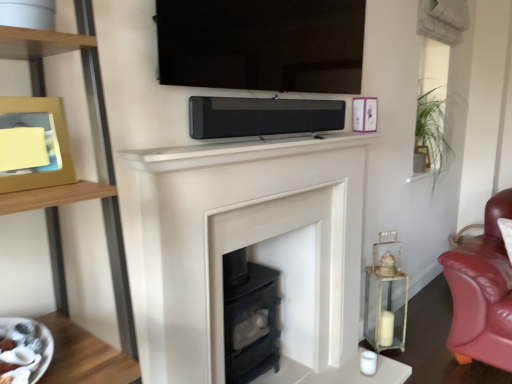
Locate an element on the screen. wooden picture frame at left, which is counted as the 1th picture frame, starting from the bottom is located at coordinates (33, 144).

This screenshot has height=384, width=512. In order to click on metallic purple picture frame at upper right, arranged as the second picture frame when viewed from the front in this screenshot , I will do `click(365, 114)`.

What is the approximate width of clear glass lantern at right?

It is 7.62 inches.

In order to click on black matte soundbar at center in this screenshot , I will do `click(261, 116)`.

Could you tell me if white glossy plate at lower left is facing metallic purple picture frame at upper right, the 2th picture frame from the left?

No, white glossy plate at lower left is not turned towards metallic purple picture frame at upper right, the 2th picture frame from the left.

Based on the photo, is white glossy plate at lower left not within metallic purple picture frame at upper right, which is counted as the 1th picture frame, starting from the back?

That's correct, white glossy plate at lower left is outside of metallic purple picture frame at upper right, which is counted as the 1th picture frame, starting from the back.

Consider the image. Which point is more distant from viewer, [114,380] or [366,125]?

Positioned behind is point [366,125].

Between white glossy plate at lower left and metallic purple picture frame at upper right, which is counted as the 1th picture frame, starting from the back, which one has smaller width?

metallic purple picture frame at upper right, which is counted as the 1th picture frame, starting from the back.

Which object is thinner, black matte soundbar at center or wooden picture frame at left, the 2th picture frame positioned from the right?

Thinner between the two is black matte soundbar at center.

Is black matte soundbar at center positioned before wooden picture frame at left, which appears as the second picture frame when viewed from the back?

No.

From the image's perspective, relative to green leafy plant at upper right, is white matte fireplace at center above or below?

Based on their image positions, white matte fireplace at center is located beneath green leafy plant at upper right.

Does white matte fireplace at center have a lesser width compared to green leafy plant at upper right?

Yes.

Is point (130, 261) positioned in front of point (437, 104)?

Yes.

Consider the image. How far apart are green leafy plant at upper right and clear glass lantern at right?

green leafy plant at upper right and clear glass lantern at right are 3.58 feet apart from each other.

Does point (438, 145) come farther from viewer compared to point (401, 346)?

Yes, point (438, 145) is behind point (401, 346).

Would you say green leafy plant at upper right contains clear glass lantern at right?

Actually, clear glass lantern at right is outside green leafy plant at upper right.

Is green leafy plant at upper right in contact with clear glass lantern at right?

No, green leafy plant at upper right is not with clear glass lantern at right.

From a real-world perspective, which is physically below, wooden picture frame at left, which appears as the 2th picture frame when viewed from the top, or white glossy plate at lower left?

white glossy plate at lower left, from a real-world perspective.

Can white glossy plate at lower left be found inside wooden picture frame at left, the 1th picture frame from the front?

No.

Does point (65, 136) appear closer or farther from the camera than point (55, 329)?

Point (65, 136) appears to be farther away from the viewer than point (55, 329).

From the image's perspective, between wooden picture frame at left, the 2th picture frame positioned from the right, and white glossy plate at lower left, which one is located above?

wooden picture frame at left, the 2th picture frame positioned from the right, from the image's perspective.

Considering the relative sizes of white matte fireplace at center and white matte fireplace mantel at center in the image provided, is white matte fireplace at center smaller than white matte fireplace mantel at center?

No.

From a real-world perspective, is white matte fireplace at center on top of white matte fireplace mantel at center?

Actually, white matte fireplace at center is physically below white matte fireplace mantel at center in the real world.

Can you tell me how much white matte fireplace at center and white matte fireplace mantel at center differ in facing direction?

There is a 0.165-degree angle between the facing directions of white matte fireplace at center and white matte fireplace mantel at center.

From the image's perspective, relative to white matte fireplace mantel at center, is white matte fireplace at center above or below?

Based on their image positions, white matte fireplace at center is located beneath white matte fireplace mantel at center.

Is wooden picture frame at left, which is counted as the 1th picture frame, starting from the bottom, beside white matte fireplace mantel at center?

No.

From the picture: From the image's perspective, is wooden picture frame at left, which is counted as the 1th picture frame, starting from the bottom, above white matte fireplace mantel at center?

Incorrect, from the image's perspective, wooden picture frame at left, which is counted as the 1th picture frame, starting from the bottom, is lower than white matte fireplace mantel at center.

Which object is further away from the camera taking this photo, wooden picture frame at left, which appears as the second picture frame when viewed from the back, or white matte fireplace mantel at center?

white matte fireplace mantel at center is more distant.

From a real-world perspective, is wooden picture frame at left, which is counted as the 1th picture frame, starting from the bottom, physically above white matte fireplace mantel at center?

Yes, from a real-world perspective, wooden picture frame at left, which is counted as the 1th picture frame, starting from the bottom, is above white matte fireplace mantel at center.

The height and width of the screenshot is (384, 512). Identify the location of table in front of the metallic purple picture frame at upper right, which is counted as the 1th picture frame, starting from the back. (84, 356).

The image size is (512, 384). Find the location of `the 2nd picture frame positioned below the black matte soundbar at center (from a real-world perspective)`. the 2nd picture frame positioned below the black matte soundbar at center (from a real-world perspective) is located at coordinates (33, 144).

Based on their spatial positions, is green leafy plant at upper right or white glossy plate at lower left further from white matte fireplace mantel at center?

green leafy plant at upper right is further to white matte fireplace mantel at center.

Estimate the real-world distances between objects in this image. Which object is further from white matte fireplace mantel at center, white glossy plate at lower left or wooden picture frame at left, the 1th picture frame from the front?

white glossy plate at lower left.

Based on their spatial positions, is black matte soundbar at center or green leafy plant at upper right further from white glossy plate at lower left?

green leafy plant at upper right is further to white glossy plate at lower left.

Considering their positions, is black matte soundbar at center positioned closer to white matte fireplace at center than clear glass lantern at right?

black matte soundbar at center is closer to white matte fireplace at center.

From the image, which object appears to be farther from white matte fireplace at center, green leafy plant at upper right or white glossy plate at lower left?

Among the two, green leafy plant at upper right is located further to white matte fireplace at center.

Estimate the real-world distances between objects in this image. Which object is further from white matte fireplace at center, metallic purple picture frame at upper right, marked as the second picture frame in a bottom-to-top arrangement, or green leafy plant at upper right?

green leafy plant at upper right is further to white matte fireplace at center.

Estimate the real-world distances between objects in this image. Which object is closer to green leafy plant at upper right, wooden picture frame at left, which appears as the 2th picture frame when viewed from the top, or metallic purple picture frame at upper right, the 2th picture frame from the left?

metallic purple picture frame at upper right, the 2th picture frame from the left, is closer to green leafy plant at upper right.

From the image, which object appears to be farther from wooden picture frame at left, which appears as the second picture frame when viewed from the back, white matte fireplace at center or metallic purple picture frame at upper right, the 2th picture frame from the left?

metallic purple picture frame at upper right, the 2th picture frame from the left.

The height and width of the screenshot is (384, 512). I want to click on stereo located between white matte fireplace mantel at center and green leafy plant at upper right in the depth direction, so [x=261, y=116].

Identify the location of fireplace between white glossy plate at lower left and metallic purple picture frame at upper right, arranged as the second picture frame when viewed from the front, along the z-axis. The height and width of the screenshot is (384, 512). (239, 243).

Locate an element on the screen. picture frame positioned between white matte fireplace mantel at center and green leafy plant at upper right from near to far is located at coordinates (365, 114).

Where is `mantle positioned between wooden picture frame at left, the 1th picture frame from the front, and green leafy plant at upper right from near to far`? The width and height of the screenshot is (512, 384). mantle positioned between wooden picture frame at left, the 1th picture frame from the front, and green leafy plant at upper right from near to far is located at coordinates (238, 151).